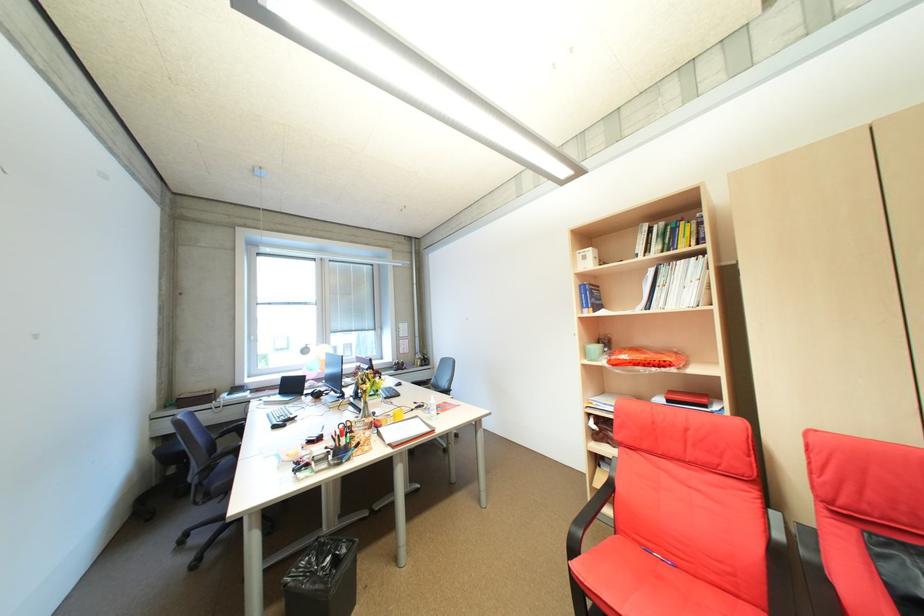
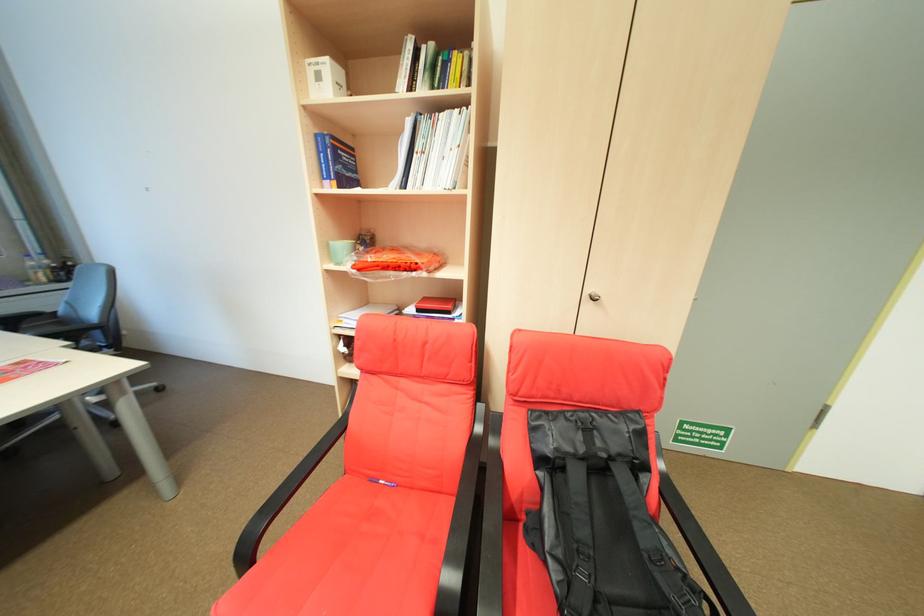
The point at (585, 523) is marked in the first image. Where is the corresponding point in the second image?

(271, 513)